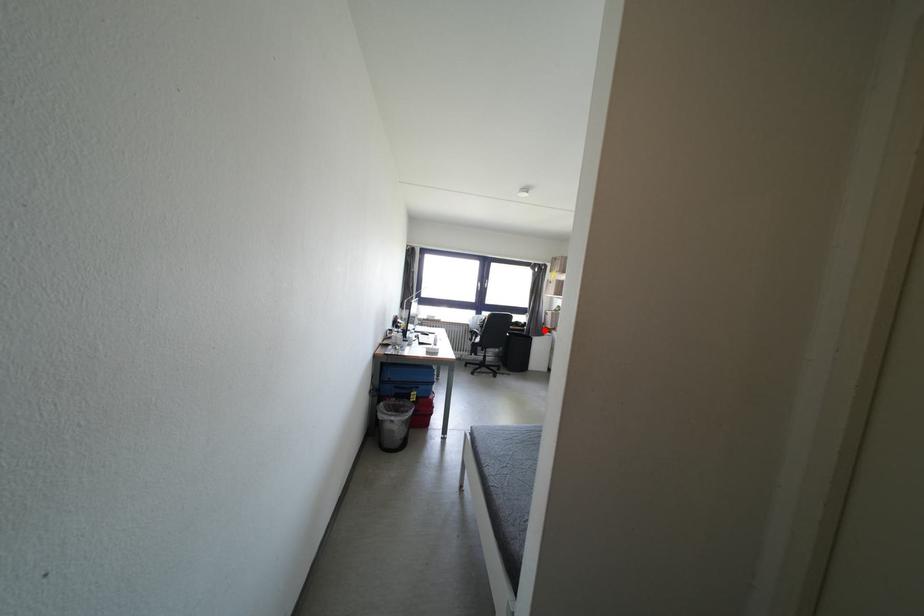
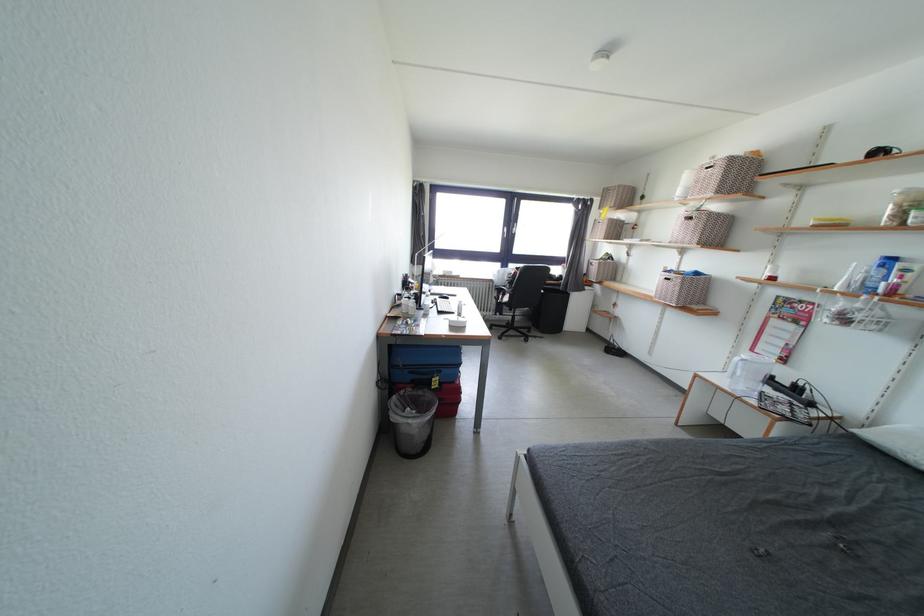
In the second image, find the point that corresponds to the highlighted location in the first image.

(584, 284)